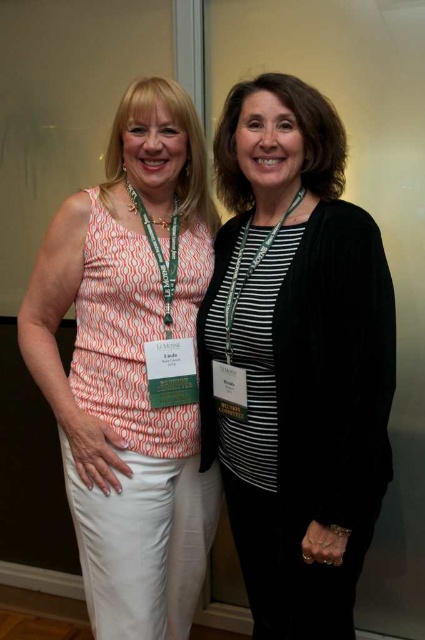
Question: Can you confirm if black velvet cardigan at center is positioned below white cotton tank top at center?

Choices:
 (A) no
 (B) yes

Answer: (A)

Question: Can you confirm if black velvet cardigan at center is thinner than white cotton tank top at center?

Choices:
 (A) no
 (B) yes

Answer: (B)

Question: Which point appears farthest from the camera in this image?

Choices:
 (A) (246, 230)
 (B) (150, 147)

Answer: (A)

Question: Can you confirm if black velvet cardigan at center is smaller than white cotton tank top at center?

Choices:
 (A) yes
 (B) no

Answer: (A)

Question: Which of the following is the closest to the observer?

Choices:
 (A) (x=283, y=186)
 (B) (x=85, y=524)

Answer: (A)